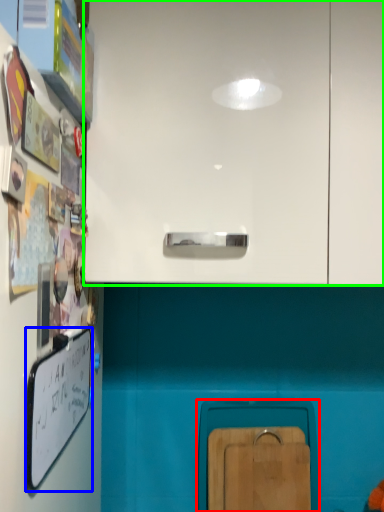
Question: Which object is positioned closest to cabinetry (highlighted by a red box)? Select from whiteboard (highlighted by a blue box) and cabinetry (highlighted by a green box).

Choices:
 (A) whiteboard
 (B) cabinetry

Answer: (A)